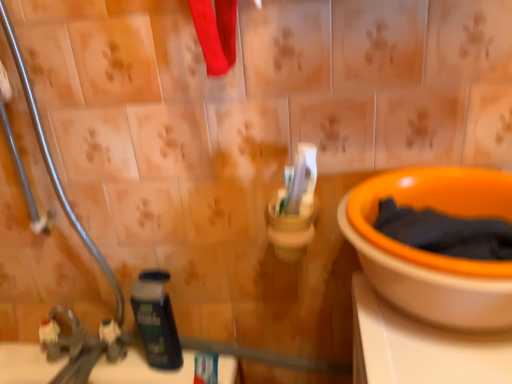
Measure the distance between point (215, 370) and camera.

The distance of point (215, 370) from camera is 36.65 inches.

Measure the distance between white matte toothpaste at lower center and camera.

white matte toothpaste at lower center and camera are 36.19 inches apart from each other.

The width and height of the screenshot is (512, 384). What do you see at coordinates (53, 162) in the screenshot?
I see `metallic silver pipe at left` at bounding box center [53, 162].

Image resolution: width=512 pixels, height=384 pixels. Find the location of `dark blue plastic shaving cream at lower left`. dark blue plastic shaving cream at lower left is located at coordinates (156, 320).

Where is `white matte toothpaste at lower center`? This screenshot has height=384, width=512. white matte toothpaste at lower center is located at coordinates (206, 368).

Measure the distance between metallic silver pipe at left and white matte toothpaste at lower center.

A distance of 16.53 inches exists between metallic silver pipe at left and white matte toothpaste at lower center.

Is metallic silver pipe at left facing away from white matte toothpaste at lower center?

metallic silver pipe at left is not turned away from white matte toothpaste at lower center.

Does metallic silver pipe at left have a greater width compared to white matte toothpaste at lower center?

In fact, metallic silver pipe at left might be narrower than white matte toothpaste at lower center.

Is metallic silver pipe at left far from white matte toothpaste at lower center?

No, there isn't a large distance between metallic silver pipe at left and white matte toothpaste at lower center.

Who is shorter, brushed metal faucet at lower left or orange plastic bowl at right?

orange plastic bowl at right.

Based on the photo, considering the positions of objects brushed metal faucet at lower left and orange plastic bowl at right in the image provided, who is in front, brushed metal faucet at lower left or orange plastic bowl at right?

orange plastic bowl at right.

Which of these two, brushed metal faucet at lower left or orange plastic bowl at right, is thinner?

With smaller width is brushed metal faucet at lower left.

Looking at this image, is orange plastic bowl at right completely or partially inside brushed metal faucet at lower left?

No, orange plastic bowl at right is not surrounded by brushed metal faucet at lower left.

Between orange plastic bowl at right and white matte toothpaste at lower center, which one has smaller width?

Thinner between the two is white matte toothpaste at lower center.

Is orange plastic bowl at right outside of white matte toothpaste at lower center?

Absolutely, orange plastic bowl at right is external to white matte toothpaste at lower center.

Based on their sizes in the image, would you say orange plastic bowl at right is bigger or smaller than white matte toothpaste at lower center?

Considering their sizes, orange plastic bowl at right takes up more space than white matte toothpaste at lower center.

Is orange plastic bowl at right aimed at white matte toothpaste at lower center?

No.

How far apart are dark blue plastic shaving cream at lower left and orange plastic bowl at right?

A distance of 19.94 inches exists between dark blue plastic shaving cream at lower left and orange plastic bowl at right.

Can you tell me how much dark blue plastic shaving cream at lower left and orange plastic bowl at right differ in facing direction?

The angle between the facing direction of dark blue plastic shaving cream at lower left and the facing direction of orange plastic bowl at right is 1.59 degrees.

Considering the relative positions of dark blue plastic shaving cream at lower left and orange plastic bowl at right in the image provided, is dark blue plastic shaving cream at lower left in front of orange plastic bowl at right?

No, the depth of dark blue plastic shaving cream at lower left is greater than that of orange plastic bowl at right.

Between dark blue plastic shaving cream at lower left and orange plastic bowl at right, which one has smaller size?

dark blue plastic shaving cream at lower left is smaller.

Based on the photo, which is correct: orange plastic bowl at right is inside brushed metal faucet at lower left, or outside of it?

orange plastic bowl at right exists outside the volume of brushed metal faucet at lower left.

From a real-world perspective, which is physically below, orange plastic bowl at right or brushed metal faucet at lower left?

From a 3D spatial view, brushed metal faucet at lower left is below.

Measure the distance between orange plastic bowl at right and brushed metal faucet at lower left.

orange plastic bowl at right is 27.45 inches from brushed metal faucet at lower left.

In the image, there is a orange plastic bowl at right. Where is `plumbing fixture below it (from a real-world perspective)`? The height and width of the screenshot is (384, 512). plumbing fixture below it (from a real-world perspective) is located at coordinates (81, 346).

Is brushed metal faucet at lower left beside metallic silver pipe at left?

There is a gap between brushed metal faucet at lower left and metallic silver pipe at left.

From the image's perspective, is brushed metal faucet at lower left beneath metallic silver pipe at left?

Yes, from the image's perspective, brushed metal faucet at lower left is below metallic silver pipe at left.

Can you tell me how much brushed metal faucet at lower left and metallic silver pipe at left differ in facing direction?

They differ by 0.00245 degrees in their facing directions.

Is brushed metal faucet at lower left spatially inside metallic silver pipe at left, or outside of it?

brushed metal faucet at lower left exists outside the volume of metallic silver pipe at left.

Consider the image. Does brushed metal faucet at lower left turn towards dark blue plastic shaving cream at lower left?

No, brushed metal faucet at lower left is not turned towards dark blue plastic shaving cream at lower left.

Considering the sizes of brushed metal faucet at lower left and dark blue plastic shaving cream at lower left in the image, is brushed metal faucet at lower left bigger or smaller than dark blue plastic shaving cream at lower left?

In the image, brushed metal faucet at lower left appears to be larger than dark blue plastic shaving cream at lower left.

From the image's perspective, does brushed metal faucet at lower left appear lower than dark blue plastic shaving cream at lower left?

Yes, from the image's perspective, brushed metal faucet at lower left is beneath dark blue plastic shaving cream at lower left.

Image resolution: width=512 pixels, height=384 pixels. I want to click on bottle above the brushed metal faucet at lower left (from the image's perspective), so click(x=156, y=320).

Where is `toothpaste behind the metallic silver pipe at left`? The height and width of the screenshot is (384, 512). toothpaste behind the metallic silver pipe at left is located at coordinates (206, 368).

Where is `toilet in front of the brushed metal faucet at lower left`? Image resolution: width=512 pixels, height=384 pixels. toilet in front of the brushed metal faucet at lower left is located at coordinates (431, 252).

From the image, which object appears to be farther from orange plastic bowl at right, brushed metal faucet at lower left or metallic silver pipe at left?

brushed metal faucet at lower left.

Estimate the real-world distances between objects in this image. Which object is closer to white matte toothpaste at lower center, orange plastic bowl at right or brushed metal faucet at lower left?

brushed metal faucet at lower left is closer to white matte toothpaste at lower center.

Looking at this image, looking at the image, which one is located closer to orange plastic bowl at right, white matte toothpaste at lower center or metallic silver pipe at left?

The object closer to orange plastic bowl at right is white matte toothpaste at lower center.

Considering their positions, is metallic silver pipe at left positioned closer to orange plastic bowl at right than white matte toothpaste at lower center?

white matte toothpaste at lower center lies closer to orange plastic bowl at right than the other object.

Estimate the real-world distances between objects in this image. Which object is closer to metallic silver pipe at left, dark blue plastic shaving cream at lower left or brushed metal faucet at lower left?

Based on the image, dark blue plastic shaving cream at lower left appears to be nearer to metallic silver pipe at left.

When comparing their distances from metallic silver pipe at left, does brushed metal faucet at lower left or dark blue plastic shaving cream at lower left seem further?

Based on the image, brushed metal faucet at lower left appears to be further to metallic silver pipe at left.

Considering their positions, is brushed metal faucet at lower left positioned further to metallic silver pipe at left than white matte toothpaste at lower center?

white matte toothpaste at lower center.

Based on their spatial positions, is metallic silver pipe at left or dark blue plastic shaving cream at lower left further from brushed metal faucet at lower left?

Among the two, metallic silver pipe at left is located further to brushed metal faucet at lower left.

Locate an element on the screen. The height and width of the screenshot is (384, 512). toothpaste between dark blue plastic shaving cream at lower left and orange plastic bowl at right in the horizontal direction is located at coordinates (206, 368).

You are a GUI agent. You are given a task and a screenshot of the screen. Output one action in this format:
    pyautogui.click(x=<x>, y=<y>)
    Task: Click on the toothpaste situated between metallic silver pipe at left and orange plastic bowl at right from left to right
    Image resolution: width=512 pixels, height=384 pixels.
    Given the screenshot: What is the action you would take?
    pyautogui.click(x=206, y=368)

Image resolution: width=512 pixels, height=384 pixels. Find the location of `bottle between metallic silver pipe at left and white matte toothpaste at lower center in the up-down direction`. bottle between metallic silver pipe at left and white matte toothpaste at lower center in the up-down direction is located at coordinates (156, 320).

Locate an element on the screen. The width and height of the screenshot is (512, 384). bottle located between metallic silver pipe at left and orange plastic bowl at right in the left-right direction is located at coordinates (156, 320).